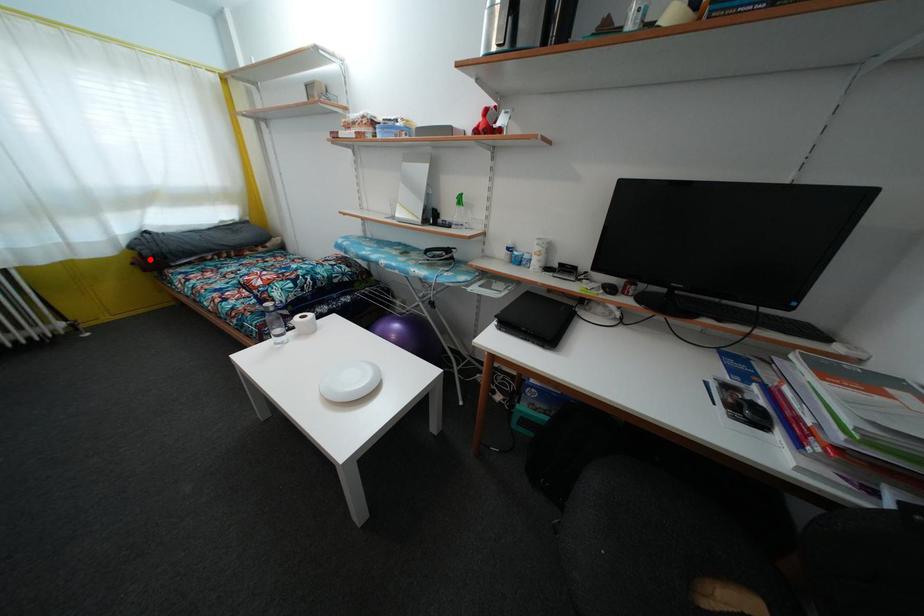
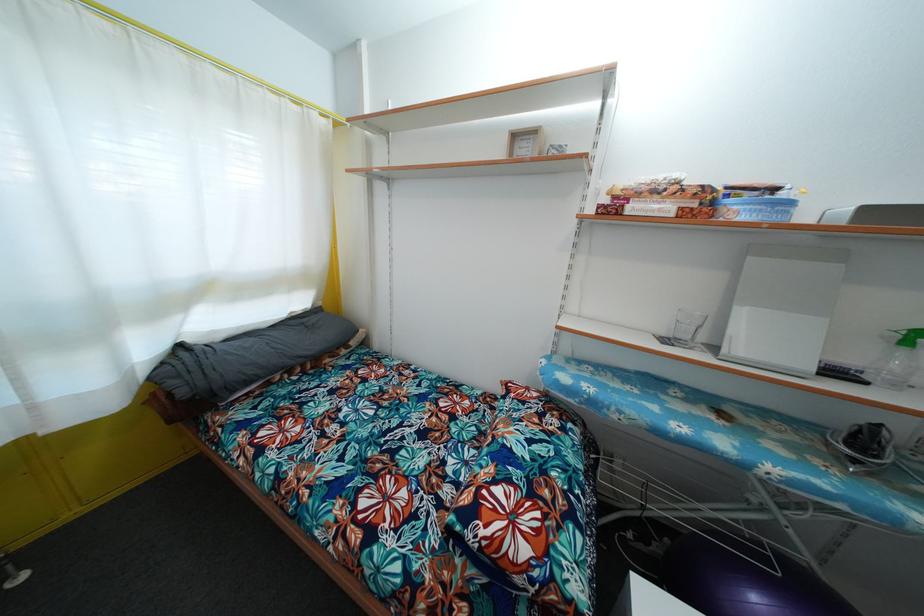
Question: I am providing you with two images of the same scene from different viewpoints. A red point is marked on the first image. Can you still see the location of the red point in image 2?

Choices:
 (A) Yes
 (B) No

Answer: (A)